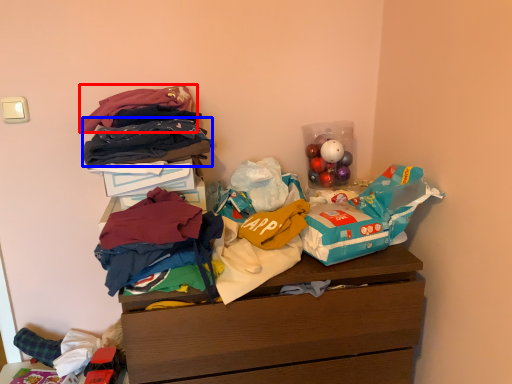
Question: Which object appears farthest to the camera in this image, clothing (highlighted by a red box) or clothing (highlighted by a blue box)?

Choices:
 (A) clothing
 (B) clothing

Answer: (A)